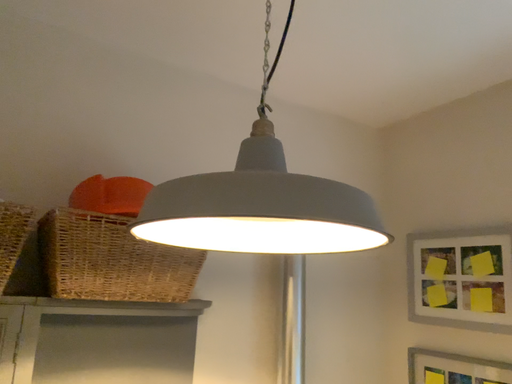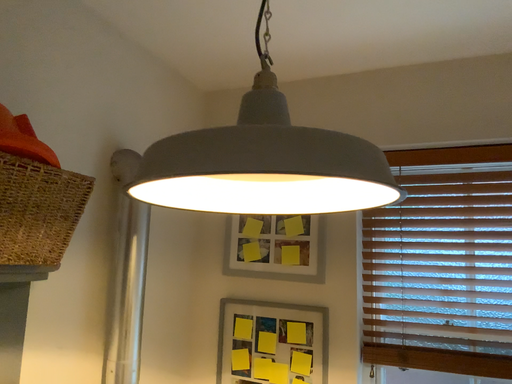
Question: Which way did the camera rotate in the video?

Choices:
 (A) rotated downward
 (B) rotated upward

Answer: (A)